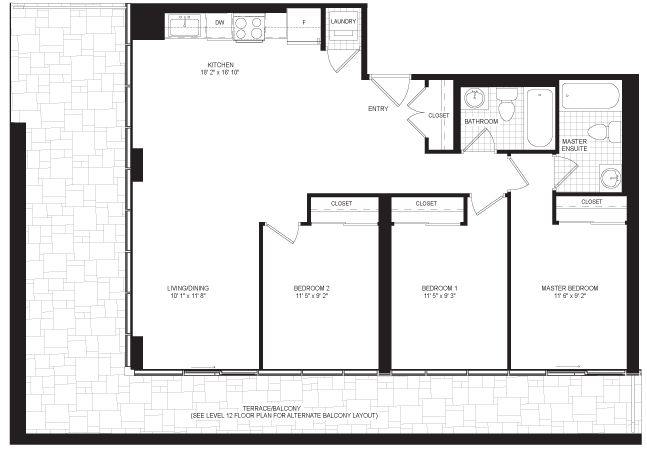
You are a GUI agent. You are given a task and a screenshot of the screen. Output one action in this format:
    pyautogui.click(x=<x>, y=<y>)
    Task: Click on the sinks
    This screenshot has height=458, width=647.
    Given the screenshot: What is the action you would take?
    pyautogui.click(x=609, y=178), pyautogui.click(x=472, y=97), pyautogui.click(x=184, y=26)